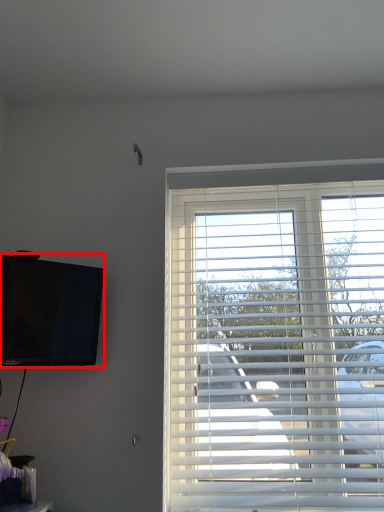
Question: From the image's perspective, where is television (annotated by the red box) located in relation to window blind in the image?

Choices:
 (A) above
 (B) below

Answer: (A)